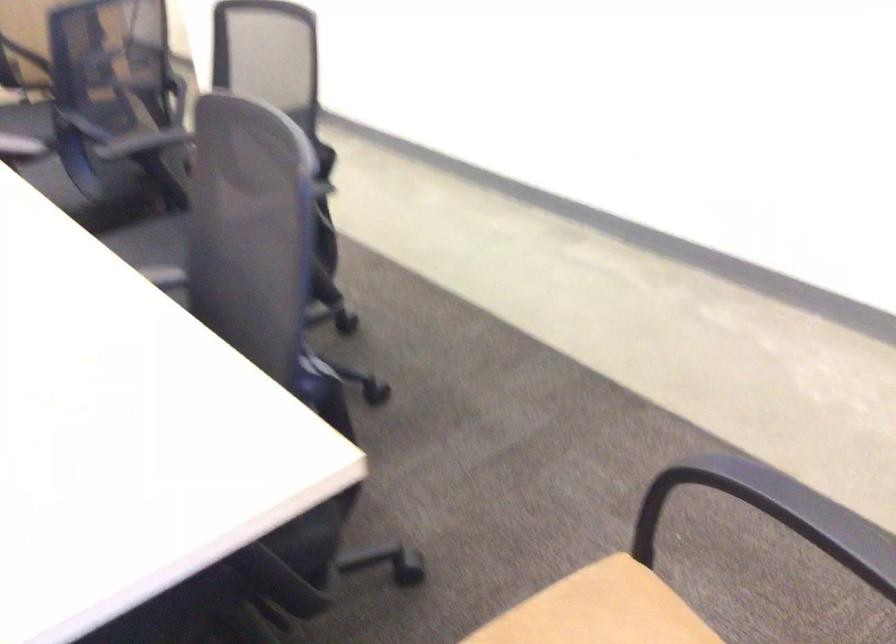
Where is `tan chair sitting surface`? tan chair sitting surface is located at coordinates (584, 609).